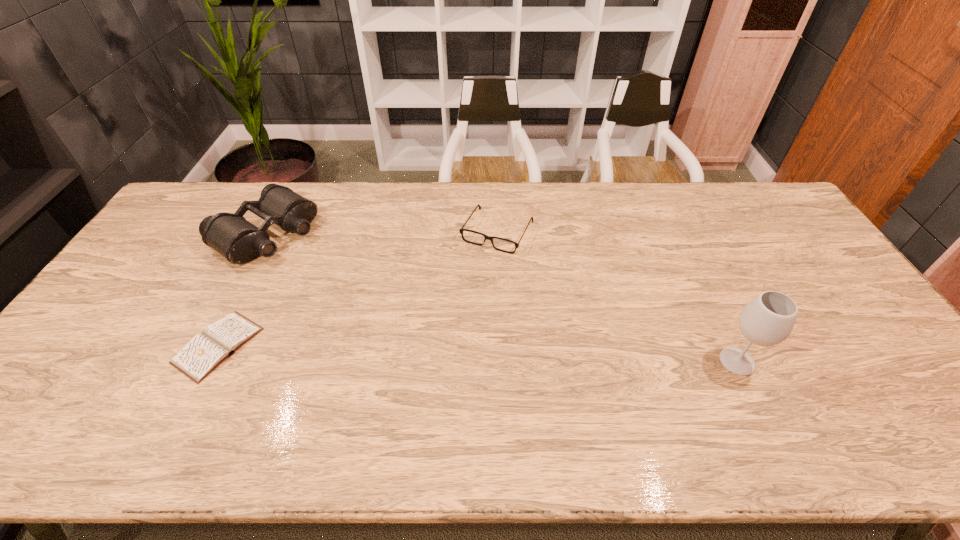
Locate an element on the screen. Image resolution: width=960 pixels, height=540 pixels. vacant space in between the tallest object and the binoculars is located at coordinates (501, 297).

Find the location of a particular element. This screenshot has height=540, width=960. free space between the third tallest object and the shortest object is located at coordinates point(358,288).

Locate an element on the screen. The height and width of the screenshot is (540, 960). free space between the tallest object and the second shortest object is located at coordinates [x=617, y=296].

Find the location of a particular element. The image size is (960, 540). free space between the diary and the wineglass is located at coordinates (477, 354).

Locate an element on the screen. This screenshot has width=960, height=540. object that is the third closest to the wineglass is located at coordinates (203, 353).

Image resolution: width=960 pixels, height=540 pixels. I want to click on object that is the third nearest to the wineglass, so click(x=203, y=353).

Image resolution: width=960 pixels, height=540 pixels. Find the location of `free space in the image that satisfies the following two spatial constraints: 1. on the back side of the diary; 2. on the right side of the third tallest object`. free space in the image that satisfies the following two spatial constraints: 1. on the back side of the diary; 2. on the right side of the third tallest object is located at coordinates (276, 231).

At what (x,y) coordinates should I click in order to perform the action: click on free space that satisfies the following two spatial constraints: 1. on the front side of the tallest object; 2. on the left side of the diary. Please return your answer as a coordinate pair (x, y). This screenshot has height=540, width=960. Looking at the image, I should click on (210, 361).

Find the location of a particular element. Image resolution: width=960 pixels, height=540 pixels. vacant area in the image that satisfies the following two spatial constraints: 1. on the front side of the diary; 2. on the right side of the tallest object is located at coordinates (210, 361).

Where is `vacant space that satisfies the following two spatial constraints: 1. on the front side of the second object from right to left; 2. on the left side of the rightmost object`? This screenshot has width=960, height=540. vacant space that satisfies the following two spatial constraints: 1. on the front side of the second object from right to left; 2. on the left side of the rightmost object is located at coordinates (503, 361).